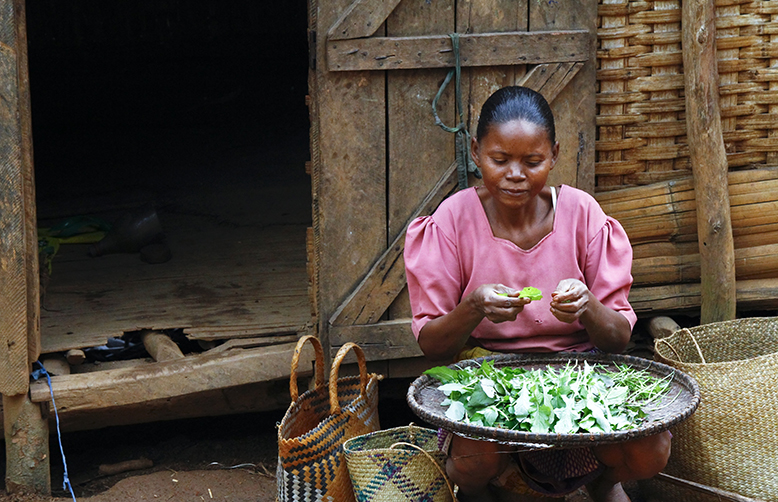
At what (x,y) coordinates should I click in order to perform the action: click on large bowl. Please return your answer as a coordinate pair (x, y). Looking at the image, I should click on (657, 415).